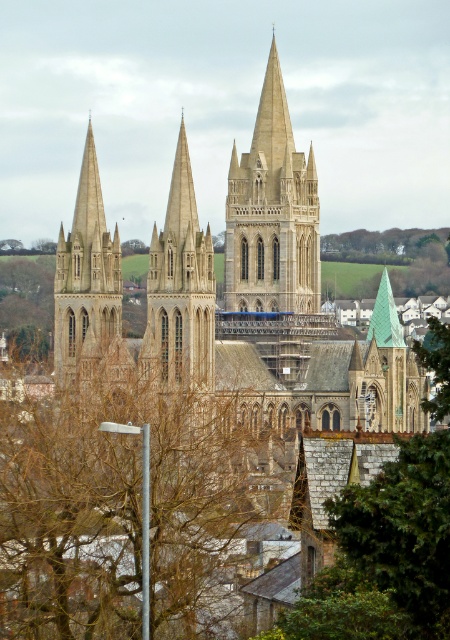
Question: Estimate the real-world distances between objects in this image. Which object is closer to the brown leafless tree at center?

Choices:
 (A) beige stone tower at center
 (B) stone spire at left
 (C) stone gothic cathedral at center

Answer: (A)

Question: From the image, what is the correct spatial relationship of stone gothic cathedral at center in relation to green leafy tree at upper center?

Choices:
 (A) left
 (B) right

Answer: (A)

Question: Which point appears farthest from the camera in this image?

Choices:
 (A) (414, 257)
 (B) (84, 243)
 (C) (165, 486)
 (D) (304, 164)

Answer: (A)

Question: Estimate the real-world distances between objects in this image. Which object is closer to the brown leafless tree at center?

Choices:
 (A) beige stone tower at center
 (B) stone gothic cathedral at center
 (C) light beige stone church at center
 (D) green leafy tree at upper center

Answer: (C)

Question: Is beige stone tower at center thinner than green leafy tree at upper center?

Choices:
 (A) no
 (B) yes

Answer: (B)

Question: Is brown leafless tree at center thinner than green leafy tree at upper center?

Choices:
 (A) yes
 (B) no

Answer: (B)